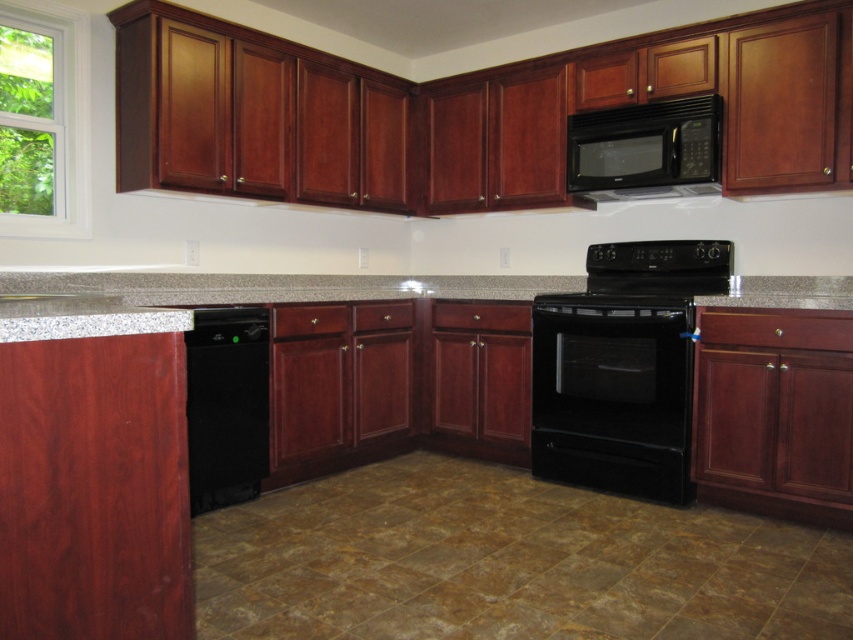
Between point (566, 390) and point (341, 291), which one is positioned behind?

Positioned behind is point (341, 291).

Locate an element on the screen. black glass oven at center is located at coordinates (612, 394).

Locate an element on the screen. The height and width of the screenshot is (640, 853). black matte microwave at upper center is located at coordinates (643, 147).

Can you confirm if black matte microwave at upper center is shorter than black glass exhaust hood at upper center?

No, black matte microwave at upper center is not shorter than black glass exhaust hood at upper center.

Between point (596, 131) and point (612, 196), which one is positioned in front?

Point (596, 131) is in front.

I want to click on black matte microwave at upper center, so click(643, 147).

Is granite at center positioned at the back of gray granite sink at lower left?

That is True.

Can you confirm if granite at center is smaller than gray granite sink at lower left?

Actually, granite at center might be larger than gray granite sink at lower left.

You are a GUI agent. You are given a task and a screenshot of the screen. Output one action in this format:
    pyautogui.click(x=<x>, y=<y>)
    Task: Click on the granite at center
    The width and height of the screenshot is (853, 640).
    Given the screenshot: What is the action you would take?
    pyautogui.click(x=216, y=296)

This screenshot has width=853, height=640. I want to click on granite at center, so click(216, 296).